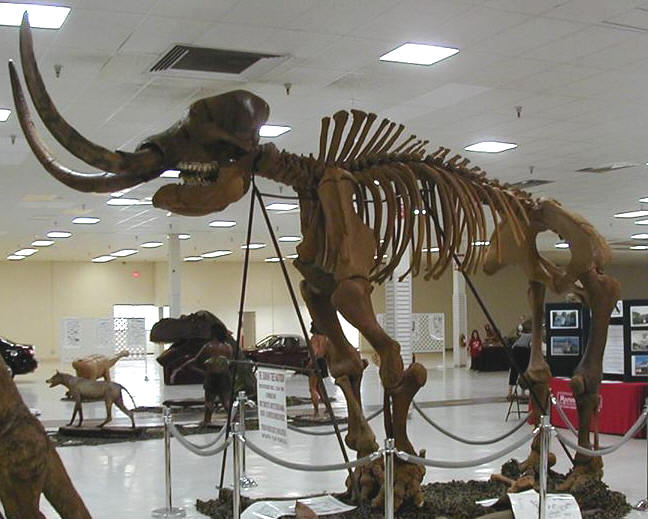
Where is `ladder`? The height and width of the screenshot is (519, 648). ladder is located at coordinates (514, 403).